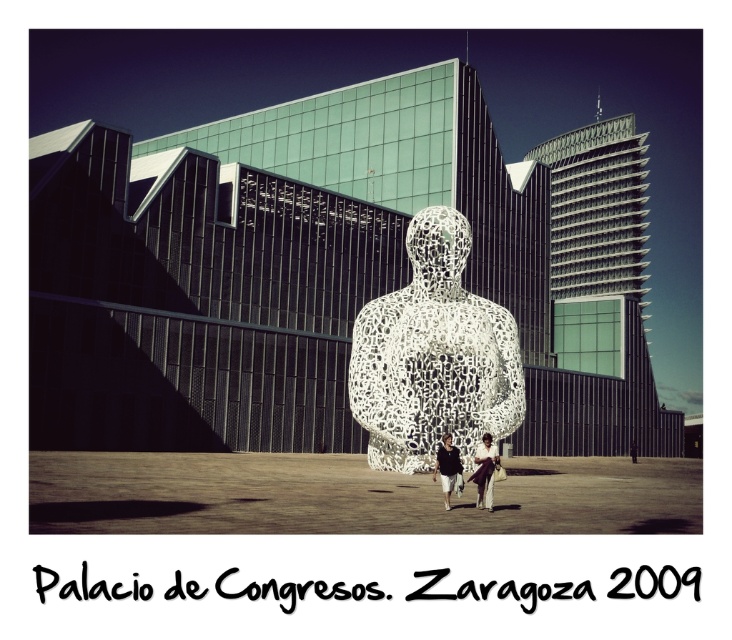
You are an architect visiting the Palacio de Congresos in Zaragoza and notice the white textured sculpture at center and the dark gray fabric pants at lower center. Which object would require more space to accommodate in a museum exhibit?

The white textured sculpture at center is larger in size than the dark gray fabric pants at lower center, so it would require more space to accommodate in a museum exhibit.

You are standing in front of the Palacio de Congresos in Zaragoza and see the white porous sculpture at center and the dark gray fabric pants at lower center. Which object is closer to you?

The white porous sculpture at center is closer to you than the dark gray fabric pants at lower center.

Based on the photo, you are an architect visiting the Palacio de Congresos in Zaragoza and see the white porous sculpture at center and the white textured sculpture at center. Which one is positioned higher in the scene?

The white porous sculpture at center is positioned higher than the white textured sculpture at center.